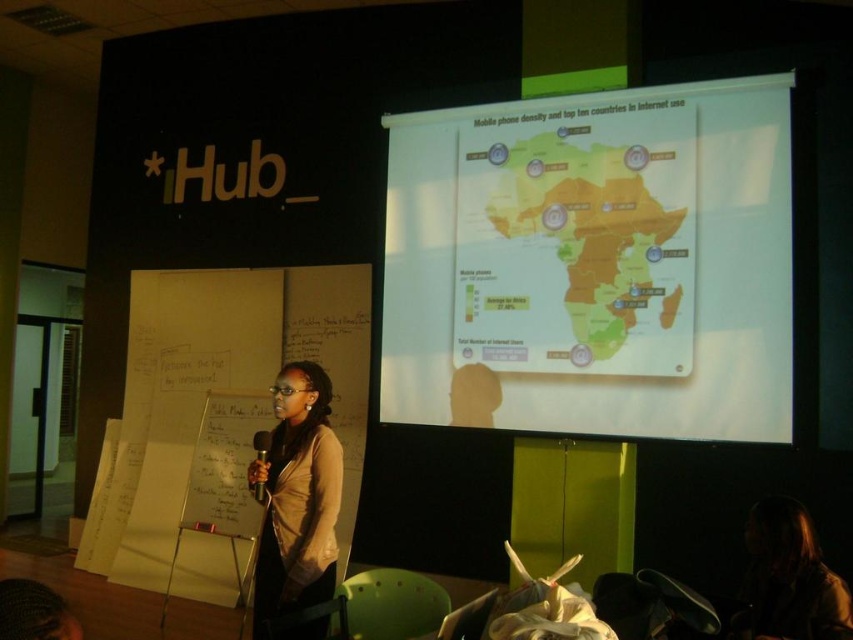
Is matte plastic map at center smaller than metallic silver microphone at center?

No, matte plastic map at center is not smaller than metallic silver microphone at center.

Is matte plastic map at center to the right of metallic silver microphone at center from the viewer's perspective?

Yes, matte plastic map at center is to the right of metallic silver microphone at center.

Locate an element on the screen. The height and width of the screenshot is (640, 853). matte plastic map at center is located at coordinates (595, 262).

Does matte beige sweater at center have a lesser width compared to metallic silver microphone at center?

In fact, matte beige sweater at center might be wider than metallic silver microphone at center.

Does point (283, 548) come closer to viewer compared to point (251, 490)?

Yes, point (283, 548) is closer to viewer.

At what (x,y) coordinates should I click in order to perform the action: click on matte beige sweater at center. Please return your answer as a coordinate pair (x, y). Looking at the image, I should click on (297, 497).

Between point (691, 131) and point (294, 458), which one is positioned in front?

Point (294, 458) is more forward.

Can you confirm if matte plastic map at center is wider than matte beige sweater at center?

Indeed, matte plastic map at center has a greater width compared to matte beige sweater at center.

Is point (535, 115) positioned after point (339, 448)?

Yes, point (535, 115) is farther from viewer.

Image resolution: width=853 pixels, height=640 pixels. In order to click on matte plastic map at center in this screenshot , I will do `click(595, 262)`.